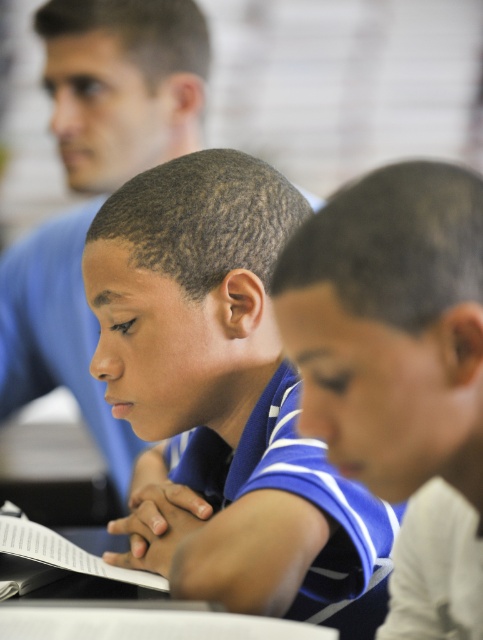
Which is more to the right, blue striped polo shirt at center or blue jersey at center?

blue jersey at center

Can you confirm if blue striped polo shirt at center is bigger than blue jersey at center?

Correct, blue striped polo shirt at center is larger in size than blue jersey at center.

Find the location of `blue striped polo shirt at center`. blue striped polo shirt at center is located at coordinates (227, 396).

Does blue jersey at center appear under blue shirt at upper left?

Correct, blue jersey at center is located below blue shirt at upper left.

Is blue jersey at center bigger than blue shirt at upper left?

No.

Which is in front, point (283, 280) or point (89, 118)?

Point (283, 280) is more forward.

Find the location of a particular element. blue jersey at center is located at coordinates (398, 369).

Where is `blue striped polo shirt at center`? blue striped polo shirt at center is located at coordinates (227, 396).

Based on the photo, does blue striped polo shirt at center appear over blue shirt at upper left?

Incorrect, blue striped polo shirt at center is not positioned above blue shirt at upper left.

The height and width of the screenshot is (640, 483). In order to click on blue striped polo shirt at center in this screenshot , I will do `click(227, 396)`.